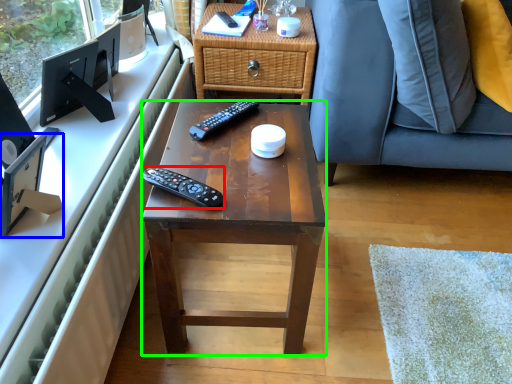
Question: Considering the real-world distances, which object is closest to remote control (highlighted by a red box)? television (highlighted by a blue box) or desk (highlighted by a green box).

Choices:
 (A) television
 (B) desk

Answer: (B)